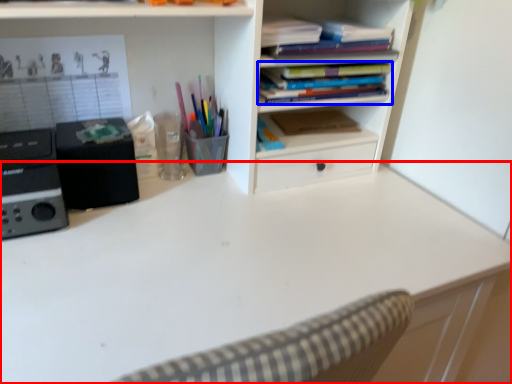
Question: Which object is closer to the camera taking this photo, desk (highlighted by a red box) or book (highlighted by a blue box)?

Choices:
 (A) desk
 (B) book

Answer: (A)